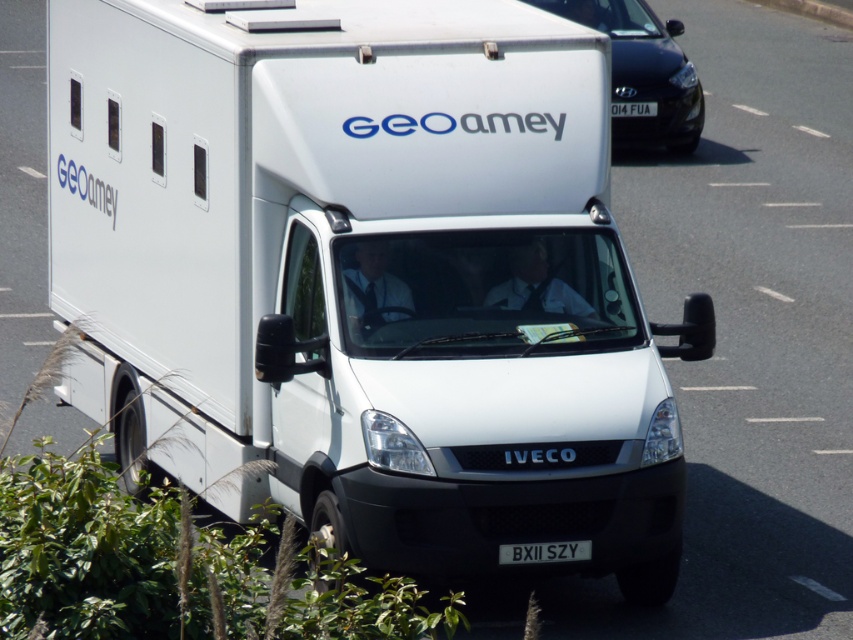
You are a traffic officer observing a road with two license plates in the scene. The black plastic license plate at center and the white plastic license plate at center. Which license plate is farther from the other?

The black plastic license plate at center is 13.49 meters away from the white plastic license plate at center, so the black plastic license plate at center is farther from the white plastic license plate at center by 13.49 meters.

You are a driver in a car behind the white Iveco van. You need to read the license plate of the van. Is the point at coordinate (544, 552) on the license plate visible to you?

The point at coordinate (544, 552) is on the black plastic license plate at center, so yes, it is visible to you as a driver behind the van.